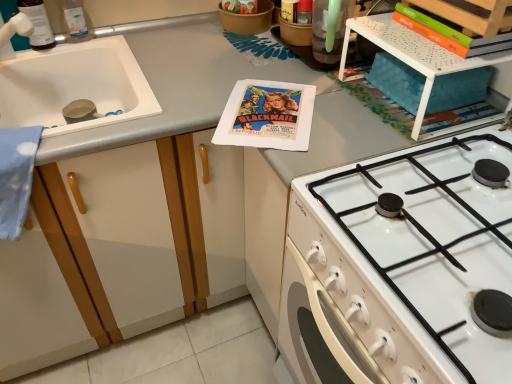
What do you see at coordinates (414, 56) in the screenshot? I see `white perforated plastic shelf at upper right` at bounding box center [414, 56].

Locate an element on the screen. clear plastic bottle at upper left, which is counted as the 1th bottle, starting from the right is located at coordinates (75, 21).

The image size is (512, 384). Identify the location of translucent plastic bottle at upper left, which is the first bottle from left to right. (38, 24).

At what (x,y) coordinates should I click in order to perform the action: click on white perforated plastic shelf at upper right. Please return your answer as a coordinate pair (x, y). The height and width of the screenshot is (384, 512). Looking at the image, I should click on (414, 56).

From the image's perspective, is white perforated plastic shelf at upper right located above translucent plastic bottle at upper left, the second bottle viewed from the right?

Actually, white perforated plastic shelf at upper right appears below translucent plastic bottle at upper left, the second bottle viewed from the right, in the image.

What are the coordinates of `the 2nd bottle directly above the white perforated plastic shelf at upper right (from a real-world perspective)` in the screenshot? It's located at (38, 24).

Does white perforated plastic shelf at upper right have a greater width compared to translucent plastic bottle at upper left, which is the first bottle from left to right?

Yes, white perforated plastic shelf at upper right is wider than translucent plastic bottle at upper left, which is the first bottle from left to right.

Can you confirm if white perforated plastic shelf at upper right is shorter than translucent plastic bottle at upper left, the second bottle viewed from the right?

Yes, white perforated plastic shelf at upper right is shorter than translucent plastic bottle at upper left, the second bottle viewed from the right.

Which point is more forward, (84, 31) or (42, 24)?

Point (42, 24)

Is clear plastic bottle at upper left, which is counted as the 1th bottle, starting from the right, not close to translucent plastic bottle at upper left, the second bottle viewed from the right?

That's not correct — clear plastic bottle at upper left, which is counted as the 1th bottle, starting from the right, is a little close to translucent plastic bottle at upper left, the second bottle viewed from the right.

Is clear plastic bottle at upper left, which is counted as the 1th bottle, starting from the right, positioned beyond the bounds of translucent plastic bottle at upper left, which is the first bottle from left to right?

clear plastic bottle at upper left, which is counted as the 1th bottle, starting from the right, lies outside translucent plastic bottle at upper left, which is the first bottle from left to right,'s area.

Is white glossy gas stove at lower right positioned behind white matte sink at left?

No, white glossy gas stove at lower right is closer to the camera.

Is white glossy gas stove at lower right turned away from white matte sink at left?

No.

From a real-world perspective, between white glossy gas stove at lower right and white matte sink at left, who is vertically higher?

In real-world perspective, white glossy gas stove at lower right is above.

Would you consider white glossy gas stove at lower right to be distant from white matte sink at left?

That's not correct — white glossy gas stove at lower right is a little close to white matte sink at left.

Is white matte sink at left not within orange matte book at upper right?

Indeed, white matte sink at left is completely outside orange matte book at upper right.

Can you confirm if white matte sink at left is bigger than orange matte book at upper right?

Yes.

Is white matte sink at left further to camera compared to orange matte book at upper right?

Yes, white matte sink at left is behind orange matte book at upper right.

Is white glossy gas stove at lower right far from orange matte book at upper right?

white glossy gas stove at lower right is actually quite close to orange matte book at upper right.

Considering the sizes of objects white glossy gas stove at lower right and orange matte book at upper right in the image provided, who is bigger, white glossy gas stove at lower right or orange matte book at upper right?

white glossy gas stove at lower right.

Which is less distant, (282, 325) or (431, 26)?

Point (431, 26)

Looking at this image, is white matte sink at left looking in the opposite direction of clear plastic bottle at upper left, which is counted as the 1th bottle, starting from the right?

white matte sink at left is not turned away from clear plastic bottle at upper left, which is counted as the 1th bottle, starting from the right.

Considering the sizes of objects white matte sink at left and clear plastic bottle at upper left, which is counted as the 1th bottle, starting from the right, in the image provided, who is smaller, white matte sink at left or clear plastic bottle at upper left, which is counted as the 1th bottle, starting from the right,?

Smaller between the two is clear plastic bottle at upper left, which is counted as the 1th bottle, starting from the right.

Is point (110, 117) in front of point (74, 22)?

That is True.

Is white matte sink at left directly adjacent to clear plastic bottle at upper left, the 2th bottle from the left?

No, white matte sink at left is not in contact with clear plastic bottle at upper left, the 2th bottle from the left.

Is clear plastic bottle at upper left, which is counted as the 1th bottle, starting from the right, at the left side of white matte sink at left?

Yes.

Could you tell me if clear plastic bottle at upper left, the 2th bottle from the left, is facing white matte sink at left?

No, clear plastic bottle at upper left, the 2th bottle from the left, is not aimed at white matte sink at left.

There is a white matte sink at left. At what (x,y) coordinates should I click in order to perform the action: click on the 2nd bottle above it (from the image's perspective). Please return your answer as a coordinate pair (x, y). Image resolution: width=512 pixels, height=384 pixels. Looking at the image, I should click on (75, 21).

Does clear plastic bottle at upper left, the 2th bottle from the left, have a lesser height compared to white matte sink at left?

Correct, clear plastic bottle at upper left, the 2th bottle from the left, is not as tall as white matte sink at left.

Which bottle is the 1st one when counting from the back of the white perforated plastic shelf at upper right? Please provide its 2D coordinates.

[(38, 24)]

The image size is (512, 384). I want to click on bottle located below the clear plastic bottle at upper left, the 2th bottle from the left (from the image's perspective), so click(x=38, y=24).

In the scene shown: From the image, which object appears to be farther from translucent plastic bottle at upper left, which is the first bottle from left to right, orange matte book at upper right or white perforated plastic shelf at upper right?

Based on the image, orange matte book at upper right appears to be further to translucent plastic bottle at upper left, which is the first bottle from left to right.

From the image, which object appears to be nearer to clear plastic bottle at upper left, which is counted as the 1th bottle, starting from the right, white glossy gas stove at lower right or orange matte book at upper right?

Among the two, orange matte book at upper right is located nearer to clear plastic bottle at upper left, which is counted as the 1th bottle, starting from the right.

Looking at the image, which one is located further to white glossy gas stove at lower right, clear plastic bottle at upper left, which is counted as the 1th bottle, starting from the right, or translucent plastic bottle at upper left, the second bottle viewed from the right?

The object further to white glossy gas stove at lower right is clear plastic bottle at upper left, which is counted as the 1th bottle, starting from the right.

When comparing their distances from white glossy gas stove at lower right, does translucent plastic bottle at upper left, the second bottle viewed from the right, or white matte sink at left seem closer?

Based on the image, white matte sink at left appears to be nearer to white glossy gas stove at lower right.

When comparing their distances from white matte sink at left, does white perforated plastic shelf at upper right or translucent plastic bottle at upper left, which is the first bottle from left to right, seem further?

Among the two, white perforated plastic shelf at upper right is located further to white matte sink at left.

From the image, which object appears to be nearer to white matte sink at left, clear plastic bottle at upper left, which is counted as the 1th bottle, starting from the right, or white perforated plastic shelf at upper right?

Answer: clear plastic bottle at upper left, which is counted as the 1th bottle, starting from the right.

Estimate the real-world distances between objects in this image. Which object is further from clear plastic bottle at upper left, the 2th bottle from the left, white perforated plastic shelf at upper right or white glossy gas stove at lower right?

The object further to clear plastic bottle at upper left, the 2th bottle from the left, is white glossy gas stove at lower right.

From the image, which object appears to be farther from white glossy gas stove at lower right, white perforated plastic shelf at upper right or translucent plastic bottle at upper left, which is the first bottle from left to right?

Based on the image, translucent plastic bottle at upper left, which is the first bottle from left to right, appears to be further to white glossy gas stove at lower right.

Find the location of `shelf between translucent plastic bottle at upper left, which is the first bottle from left to right, and white glossy gas stove at lower right`. shelf between translucent plastic bottle at upper left, which is the first bottle from left to right, and white glossy gas stove at lower right is located at coordinates (414, 56).

Locate an element on the screen. The height and width of the screenshot is (384, 512). bottle between translucent plastic bottle at upper left, which is the first bottle from left to right, and white perforated plastic shelf at upper right is located at coordinates (75, 21).

Identify the location of sink between translucent plastic bottle at upper left, the second bottle viewed from the right, and white glossy gas stove at lower right from left to right. Image resolution: width=512 pixels, height=384 pixels. (74, 85).

This screenshot has height=384, width=512. In order to click on sink located between translucent plastic bottle at upper left, the second bottle viewed from the right, and orange matte book at upper right in the left-right direction in this screenshot , I will do [74, 85].